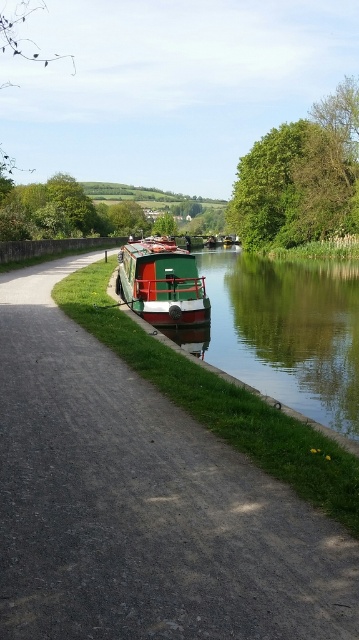
Is point (136, 435) more distant than point (173, 262)?

No, (136, 435) is in front of (173, 262).

Is point (2, 280) positioned after point (128, 289)?

Yes, it is.

Image resolution: width=359 pixels, height=640 pixels. What are the coordinates of `green matte boat at center` in the screenshot? It's located at (142, 502).

Does green matte boat at center have a lesser width compared to green leafy tree at upper right?

Yes.

Which is below, green matte boat at center or green leafy tree at upper right?

green matte boat at center is below.

Does point (115, 371) come in front of point (300, 168)?

Yes, it is.

At what (x,y) coordinates should I click in order to perform the action: click on green matte boat at center. Please return your answer as a coordinate pair (x, y). This screenshot has width=359, height=640. Looking at the image, I should click on (142, 502).

Between green leafy tree at upper right and green polished wood barge at center, which one has less height?

green polished wood barge at center is shorter.

Where is `green leafy tree at upper right`? The image size is (359, 640). green leafy tree at upper right is located at coordinates (294, 188).